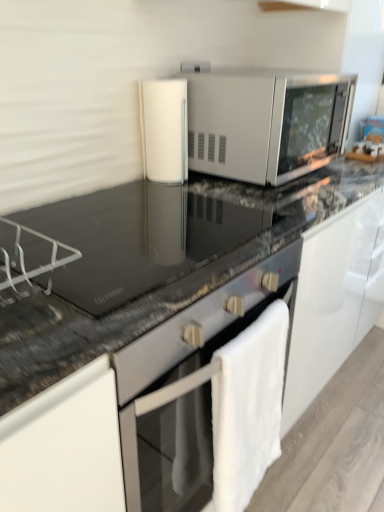
Question: Is black glass countertop at center, the first countertop when ordered from top to bottom, outside of white glossy cylindrical container at center?

Choices:
 (A) yes
 (B) no

Answer: (A)

Question: Does black glass countertop at center, which is counted as the 2th countertop, starting from the bottom, appear on the left side of white glossy cylindrical container at center?

Choices:
 (A) no
 (B) yes

Answer: (B)

Question: Are black glass countertop at center, the first countertop when ordered from top to bottom, and white glossy cylindrical container at center far apart?

Choices:
 (A) yes
 (B) no

Answer: (B)

Question: Is the depth of black glass countertop at center, the first countertop when ordered from top to bottom, greater than that of white glossy cylindrical container at center?

Choices:
 (A) no
 (B) yes

Answer: (A)

Question: Is white glossy cylindrical container at center at the back of black glass countertop at center, the first countertop when ordered from top to bottom?

Choices:
 (A) no
 (B) yes

Answer: (A)

Question: From a real-world perspective, does black glass countertop at center, which is counted as the 2th countertop, starting from the bottom, stand above white glossy cylindrical container at center?

Choices:
 (A) no
 (B) yes

Answer: (A)

Question: Is the depth of white fluffy bath towel at lower right greater than that of black glass countertop at center, which is counted as the 2th countertop, starting from the bottom?

Choices:
 (A) yes
 (B) no

Answer: (A)

Question: Is white fluffy bath towel at lower right shorter than black glass countertop at center, the first countertop when ordered from top to bottom?

Choices:
 (A) no
 (B) yes

Answer: (A)

Question: Is white fluffy bath towel at lower right to the right of black glass countertop at center, which is counted as the 2th countertop, starting from the bottom, from the viewer's perspective?

Choices:
 (A) no
 (B) yes

Answer: (B)

Question: From the image's perspective, is white fluffy bath towel at lower right under black glass countertop at center, the first countertop when ordered from top to bottom?

Choices:
 (A) no
 (B) yes

Answer: (B)

Question: Is white fluffy bath towel at lower right not within black glass countertop at center, which is counted as the 2th countertop, starting from the bottom?

Choices:
 (A) no
 (B) yes

Answer: (B)

Question: From the image's perspective, is white fluffy bath towel at lower right over black glass countertop at center, which is counted as the 2th countertop, starting from the bottom?

Choices:
 (A) no
 (B) yes

Answer: (A)

Question: Is white glossy cylindrical container at center to the left of white fluffy bath towel at lower right from the viewer's perspective?

Choices:
 (A) yes
 (B) no

Answer: (A)